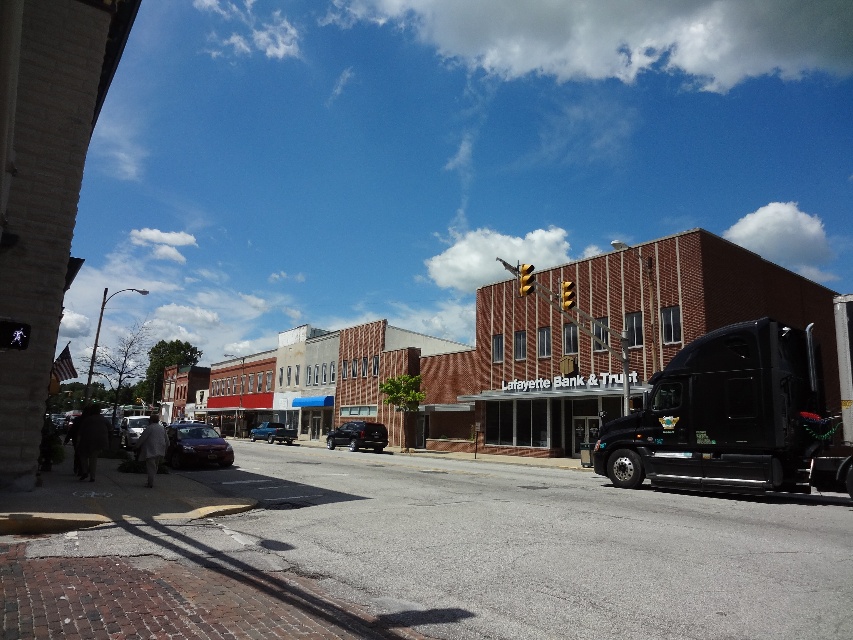
Question: Considering the real-world distances, which object is farthest from the shiny black sedan at lower left?

Choices:
 (A) satin black suv at center
 (B) shiny dark red sedan at center
 (C) metallic blue truck at center

Answer: (C)

Question: Does black glossy trailer truck at right have a lesser width compared to shiny dark red sedan at center?

Choices:
 (A) yes
 (B) no

Answer: (A)

Question: Does metallic blue truck at center appear under shiny black sedan at lower left?

Choices:
 (A) no
 (B) yes

Answer: (B)

Question: Which object is positioned farthest from the metallic blue truck at center?

Choices:
 (A) shiny dark red sedan at center
 (B) satin black suv at center
 (C) shiny black sedan at lower left
 (D) black glossy trailer truck at right

Answer: (D)

Question: Which point is closer to the camera taking this photo?

Choices:
 (A) (123, 426)
 (B) (173, 456)

Answer: (B)

Question: Is satin black suv at center wider than shiny black sedan at lower left?

Choices:
 (A) yes
 (B) no

Answer: (B)